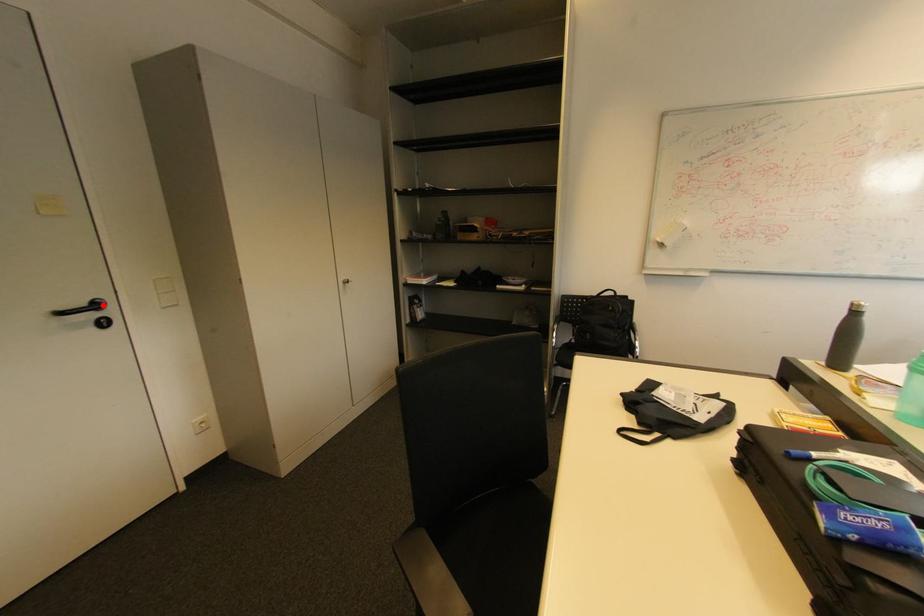
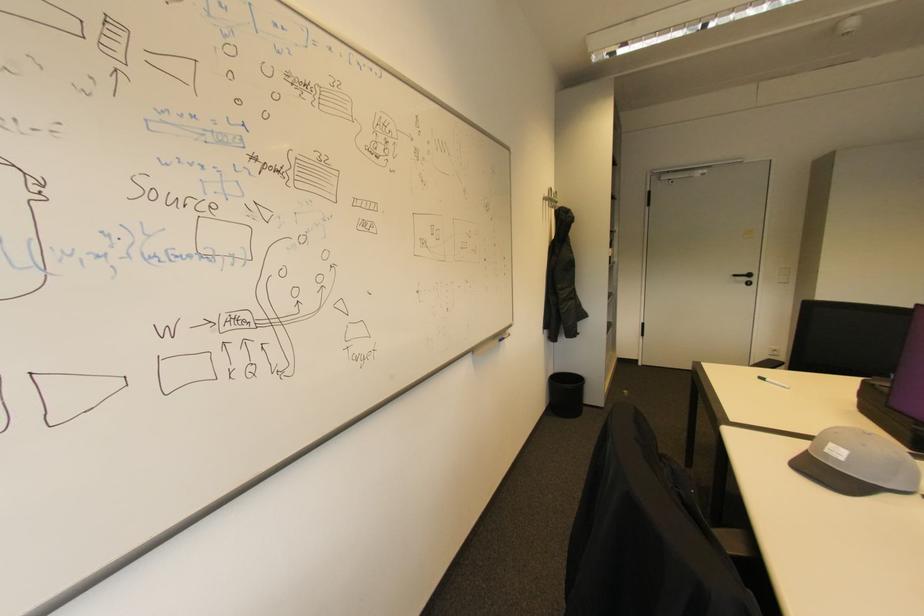
Where in the second image is the point corresponding to the highlighted location from the first image?

(755, 276)